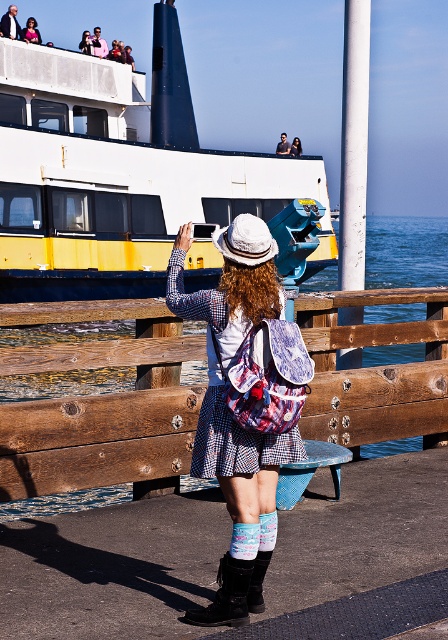
You are a tailor measuring clothing items in the image. The black leather boot at lower center and the pink fabric jacket at upper center need to be altered to fit a customer. Which item requires more fabric for its width? Explain your reasoning based on their current sizes.

The pink fabric jacket at upper center requires more fabric for its width because the black leather boot at lower center has a smaller width than the pink fabric jacket at upper center.